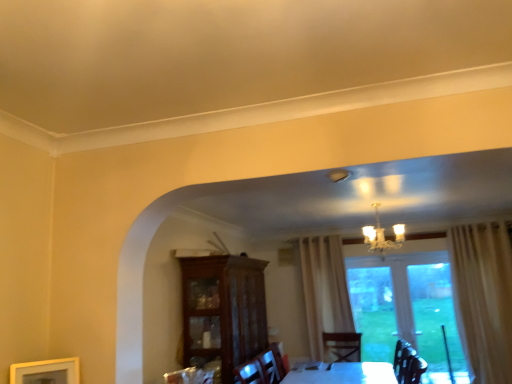
Question: From the image's perspective, is transparent glass door at center located above or below gold metallic chandelier at upper center?

Choices:
 (A) above
 (B) below

Answer: (B)

Question: Is point (460, 365) positioned closer to the camera than point (381, 241)?

Choices:
 (A) farther
 (B) closer

Answer: (B)

Question: Which object is positioned farthest from the wooden picture frame at lower left?

Choices:
 (A) mahogany glass-front cabinet at center
 (B) transparent glass door at center
 (C) gold metallic chandelier at upper center

Answer: (B)

Question: Which object is positioned farthest from the transparent glass door at center?

Choices:
 (A) mahogany glass-front cabinet at center
 (B) wooden picture frame at lower left
 (C) gold metallic chandelier at upper center

Answer: (B)